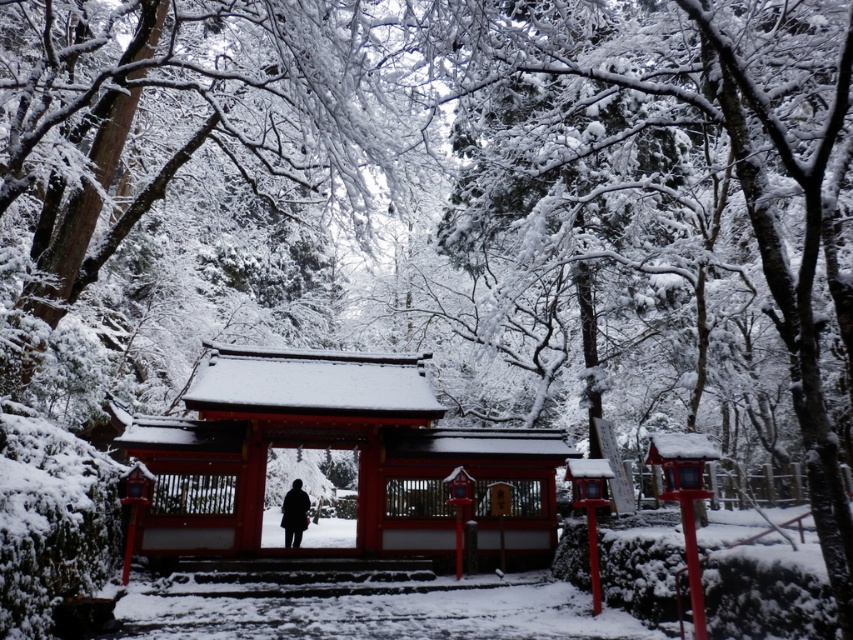
Question: Which point appears closest to the camera in this image?

Choices:
 (A) (296, 497)
 (B) (553, 540)

Answer: (B)

Question: Does shiny lacquered shrine gate at center have a lesser width compared to black wool coat at center?

Choices:
 (A) no
 (B) yes

Answer: (A)

Question: Among these points, which one is nearest to the camera?

Choices:
 (A) (294, 520)
 (B) (143, 532)

Answer: (B)

Question: Is shiny lacquered shrine gate at center to the left of black wool coat at center from the viewer's perspective?

Choices:
 (A) no
 (B) yes

Answer: (A)

Question: Is shiny lacquered shrine gate at center thinner than black wool coat at center?

Choices:
 (A) yes
 (B) no

Answer: (B)